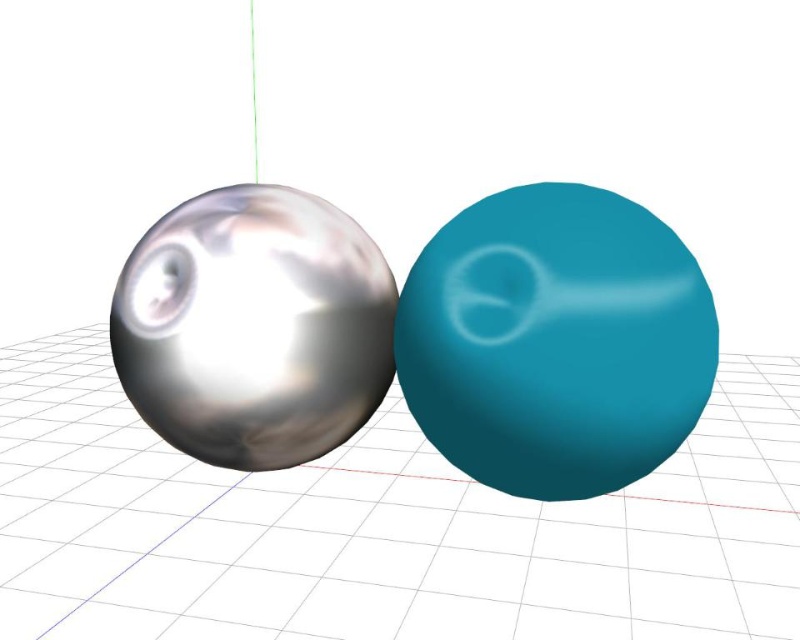
Question: Which point is farther to the camera?

Choices:
 (A) teal rubber bowling ball at center
 (B) metallic sphere at center

Answer: (B)

Question: Can you confirm if metallic sphere at center is smaller than teal rubber bowling ball at center?

Choices:
 (A) no
 (B) yes

Answer: (A)

Question: Does metallic sphere at center have a lesser width compared to teal rubber bowling ball at center?

Choices:
 (A) yes
 (B) no

Answer: (B)

Question: Does metallic sphere at center have a lesser width compared to teal rubber bowling ball at center?

Choices:
 (A) no
 (B) yes

Answer: (A)

Question: Which point is closer to the camera taking this photo?

Choices:
 (A) [x=548, y=380]
 (B) [x=156, y=483]

Answer: (A)